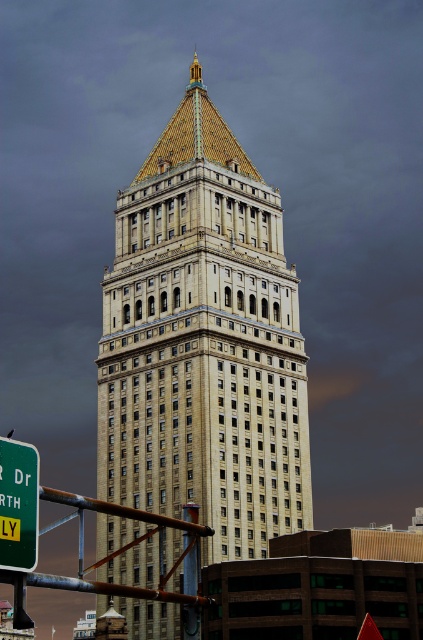
Is point (296, 380) positioned behind point (10, 461)?

That is True.

Which is more to the left, beige stone tower at center or green plastic sign at lower left?

beige stone tower at center

Which is in front, point (211, 337) or point (0, 452)?

Point (0, 452) is more forward.

Identify the location of beige stone tower at center. (203, 342).